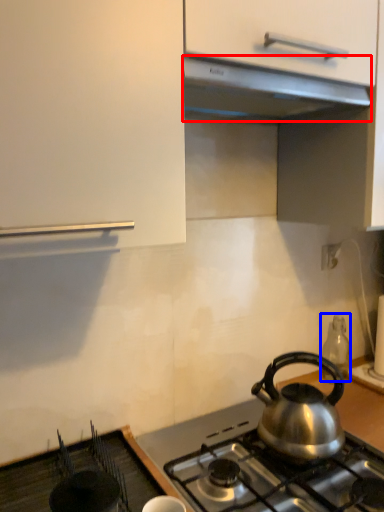
Question: Among these objects, which one is nearest to the camera, exhaust hood (highlighted by a red box) or appliance (highlighted by a blue box)?

Choices:
 (A) exhaust hood
 (B) appliance

Answer: (A)